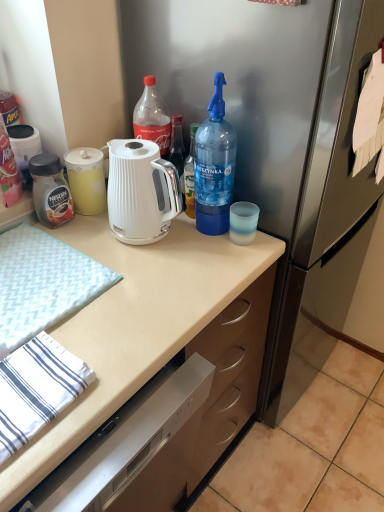
At what (x,y) coordinates should I click in order to perform the action: click on vacant area in front of matte black jar at left, which is the 2th bottle in left-to-right order. Please return your answer as a coordinate pair (x, y). This screenshot has width=384, height=512. Looking at the image, I should click on (75, 240).